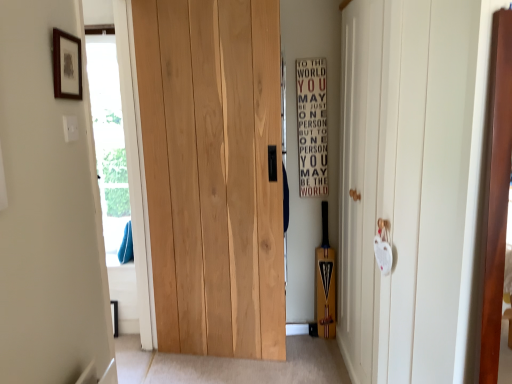
Question: Is natural wood door at center, which is the first door in left-to-right order, taller or shorter than transparent glass door at left?

Choices:
 (A) tall
 (B) short

Answer: (B)

Question: In terms of width, does natural wood door at center, the second door from the right, look wider or thinner when compared to transparent glass door at left?

Choices:
 (A) wide
 (B) thin

Answer: (B)

Question: Which object is positioned farthest from the transparent glass door at left?

Choices:
 (A) wooden framed print at upper left
 (B) wooden sign at center right
 (C) natural wood door at center, which is the first door in left-to-right order
 (D) white matte door at right, the second door in the left-to-right sequence

Answer: (D)

Question: Which object is the closest to the wooden sign at center right?

Choices:
 (A) transparent glass door at left
 (B) white matte door at right, the first door when ordered from right to left
 (C) wooden framed print at upper left
 (D) natural wood door at center, which is the first door in left-to-right order

Answer: (D)